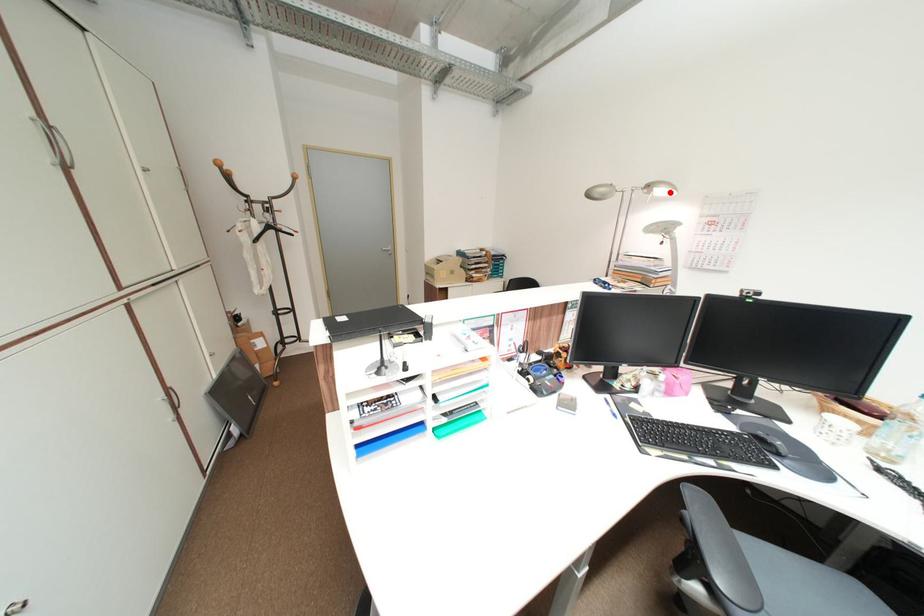
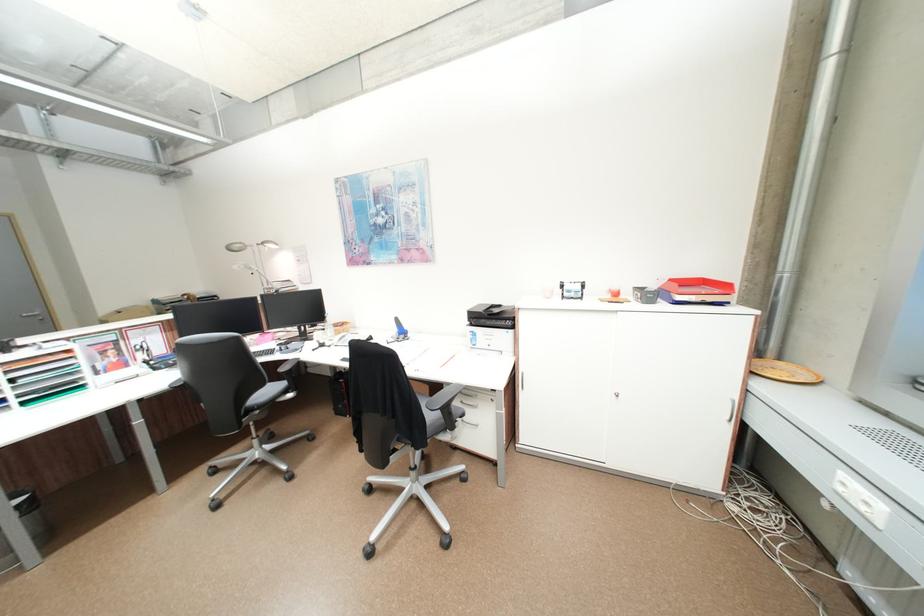
Question: I am providing you with two images of the same scene from different viewpoints. Given a red point in image1, look at the same physical point in image2. Is it:

Choices:
 (A) Closer to the viewpoint
 (B) Farther from the viewpoint

Answer: (A)